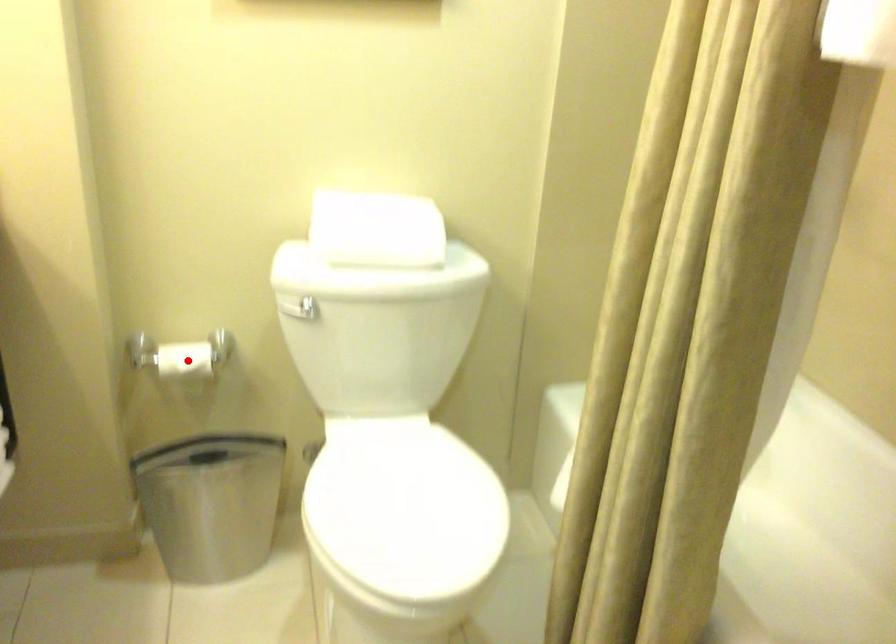
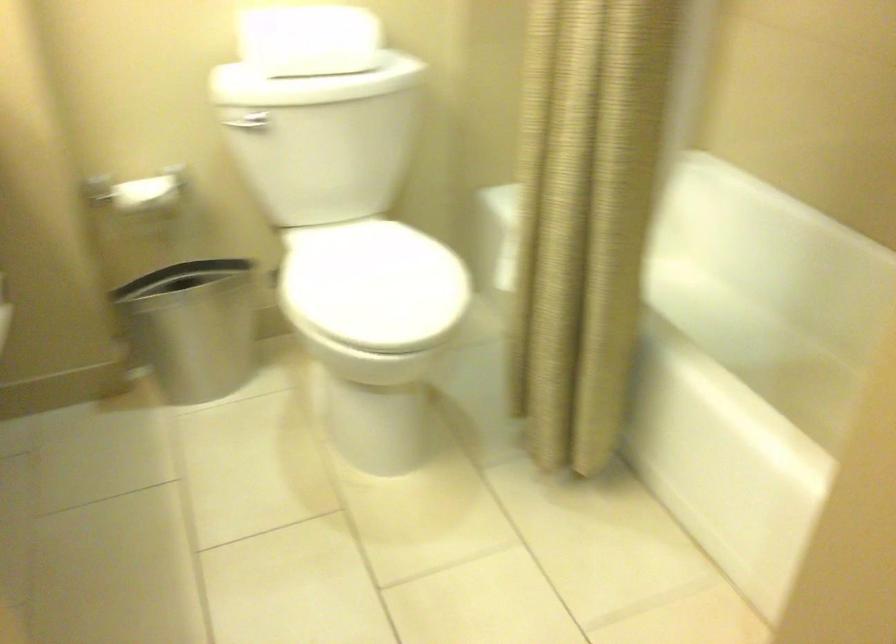
Locate, in the second image, the point that corresponds to the highlighted location in the first image.

(147, 193)